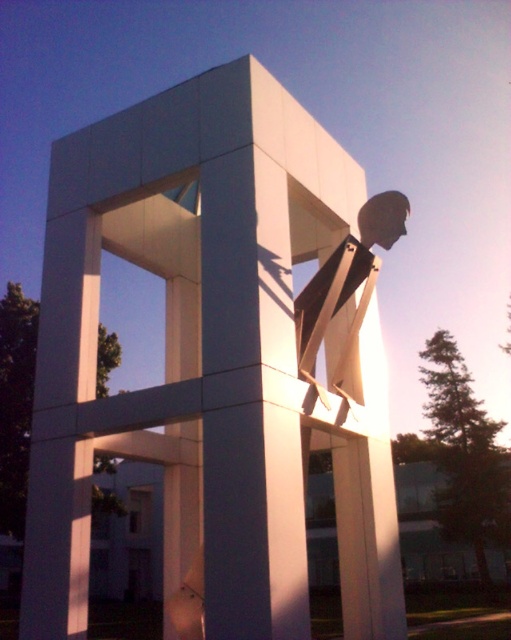
Is white matte sculpture at center in front of white matte statue at center?

Yes, white matte sculpture at center is in front of white matte statue at center.

Is white matte sculpture at center to the left of white matte statue at center from the viewer's perspective?

Indeed, white matte sculpture at center is positioned on the left side of white matte statue at center.

Image resolution: width=511 pixels, height=640 pixels. What do you see at coordinates (216, 364) in the screenshot?
I see `white matte sculpture at center` at bounding box center [216, 364].

At what (x,y) coordinates should I click in order to perform the action: click on white matte sculpture at center. Please return your answer as a coordinate pair (x, y). The height and width of the screenshot is (640, 511). Looking at the image, I should click on (216, 364).